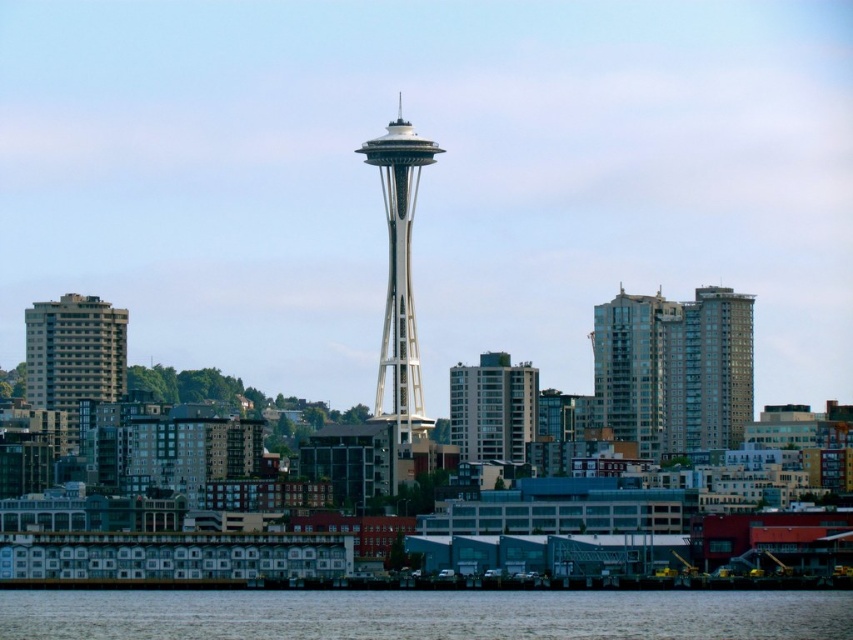
You are a drone operator tasked with capturing aerial footage of the city. Your drone is currently hovering at a safe altitude above the white metallic space needle at center and the matte glass building at center. Which object would you need to descend lower to film from above?

The white metallic space needle at center is above the matte glass building at center, so you would need to descend lower to film the matte glass building at center from above since it is positioned lower.

You are standing in the city and want to take a photo of the gray concrete building at left and the matte glass building at center. Which building should you focus on first if you want to capture both in one shot without moving your camera?

You should focus on the gray concrete building at left first because it is closer to you than the matte glass building at center, allowing both to be in focus within the same frame.